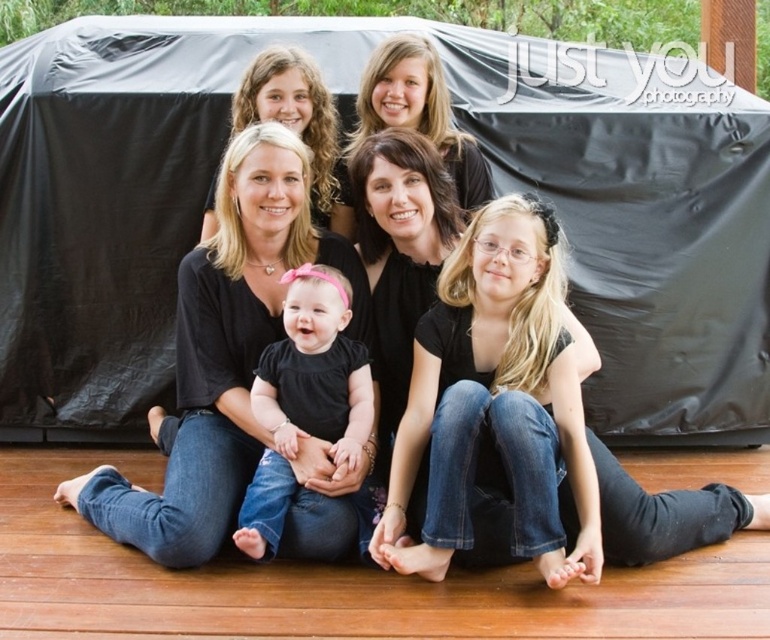
You are a photographer who needs to adjust the lighting for the black matte dress at center and the matte black shirt at upper center. Since both are black, you want to ensure they are distinguishable in the photo. Which object should you focus on first to adjust the lighting, considering their positions?

The black matte dress at center is located below the matte black shirt at upper center. Therefore, you should focus on adjusting the lighting for the matte black shirt at upper center first, as it is positioned higher and might require different lighting to stand out against the background.

You are a photographer trying to adjust the lighting for a group photo. The scene has a blonde hair at center and a matte black shirt at upper center. Given the distance between them, can you estimate if a 6 feet long light reflector placed between them would reach both subjects?

The distance between the blonde hair at center and the matte black shirt at upper center is 5.74 feet. A 6 feet long light reflector placed between them would comfortably reach both subjects since it is longer than the distance separating them.

You are a photographer trying to adjust the lighting for a family photo. You notice a point at coordinates [496,401]. What is located at this point in the image?

The point at coordinates [496,401] corresponds to the blonde hair at center.